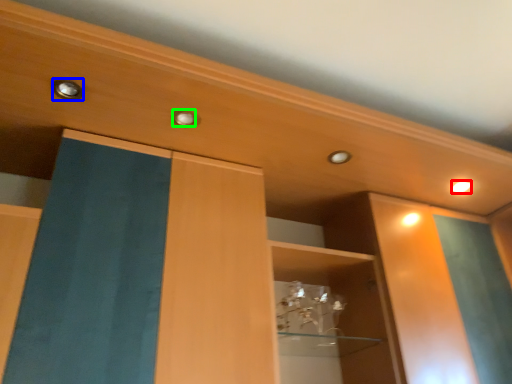
Question: Considering the real-world distances, which object is farthest from lighting (highlighted by a red box)? knob (highlighted by a blue box) or knob (highlighted by a green box)?

Choices:
 (A) knob
 (B) knob

Answer: (A)